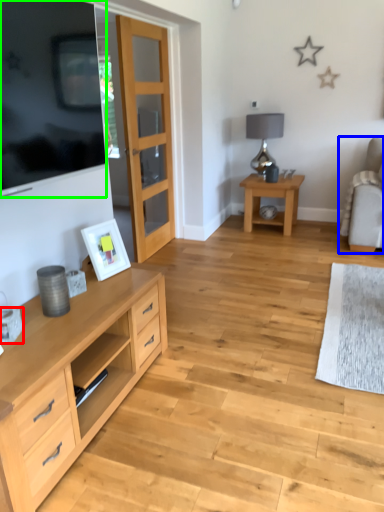
Question: Which is nearer to the coffee cup (highlighted by a red box)? chair (highlighted by a blue box) or television (highlighted by a green box).

Choices:
 (A) chair
 (B) television

Answer: (B)